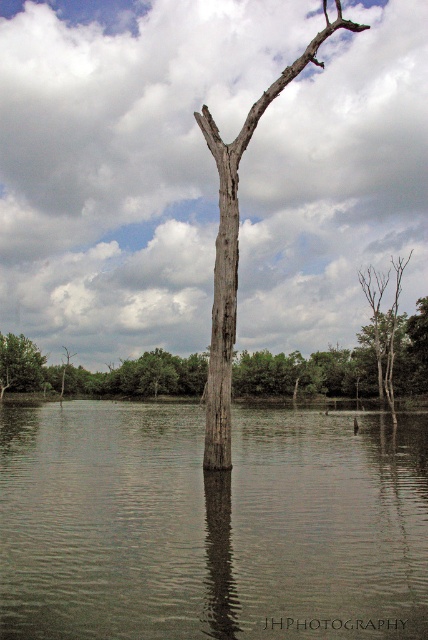
Is point (363, 285) farther from viewer compared to point (29, 374)?

Yes, it is behind point (29, 374).

Which is in front, point (389, 278) or point (5, 362)?

Point (5, 362) is more forward.

The width and height of the screenshot is (428, 640). Identify the location of bare wood tree at right. (383, 321).

Who is positioned more to the right, brown matte tree trunk at center or green matte tree at left?

brown matte tree trunk at center

Who is more distant from viewer, (71, 550) or (0, 360)?

Positioned behind is point (0, 360).

Is point (276, 490) farther from camera compared to point (18, 371)?

No.

Where is `brown matte tree trunk at center`? This screenshot has width=428, height=640. brown matte tree trunk at center is located at coordinates (211, 524).

Between brown matte tree trunk at center and bare wood tree at right, which one has more height?

bare wood tree at right

Between point (59, 464) and point (376, 353), which one is positioned in front?

Point (59, 464)

This screenshot has height=640, width=428. What are the coordinates of `brown matte tree trunk at center` in the screenshot? It's located at (211, 524).